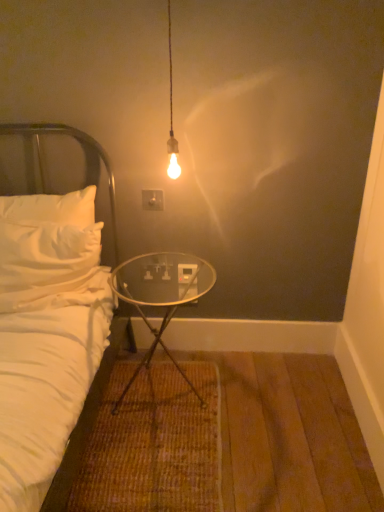
Where is `free space on the front side of transparent glass table at center`? The image size is (384, 512). free space on the front side of transparent glass table at center is located at coordinates (165, 464).